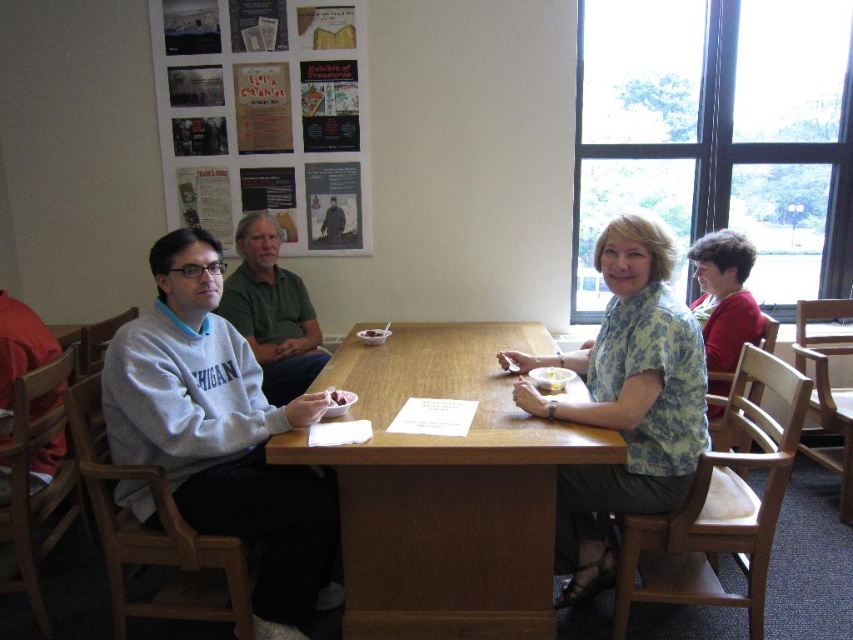
Question: Which of the following is the farthest from the observer?

Choices:
 (A) green cotton shirt at center
 (B) matte plastic bowl at center
 (C) gray fleece sweater at left

Answer: (B)

Question: Does gray fleece sweater at left have a lesser width compared to blue floral blouse at center?

Choices:
 (A) yes
 (B) no

Answer: (B)

Question: Does gray fleece sweater at left appear under brown matte cookie at center?

Choices:
 (A) yes
 (B) no

Answer: (A)

Question: Which object is the farthest from the matte plastic bowl at center?

Choices:
 (A) wooden table at center
 (B) paper posters at upper left

Answer: (B)

Question: Which point is farther to the camera?

Choices:
 (A) dark brown leather jacket at center
 (B) gray fleece sweater at left
 (C) wooden table at center
 (D) matte plastic bowl at center

Answer: (A)

Question: Is wooden table at center positioned behind blue floral blouse at center?

Choices:
 (A) yes
 (B) no

Answer: (B)